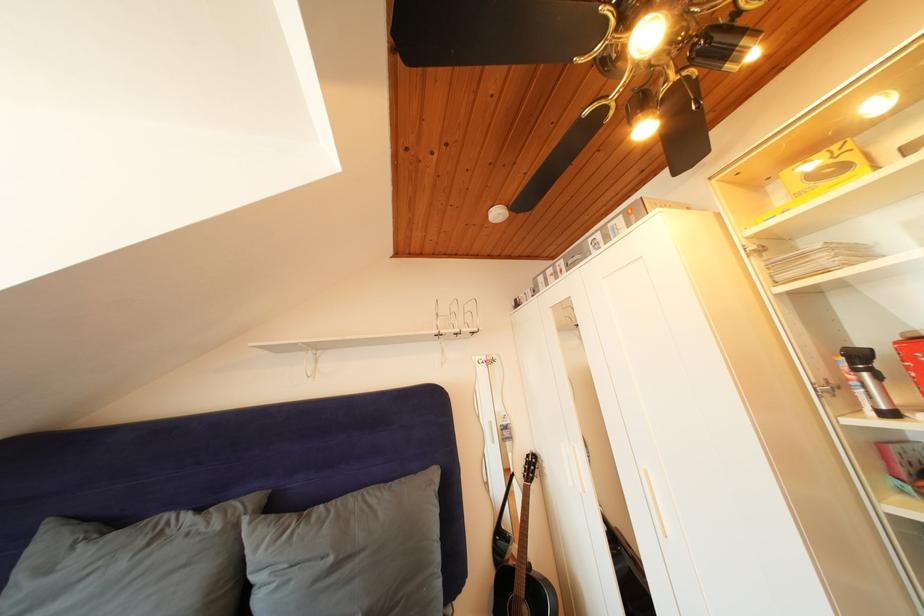
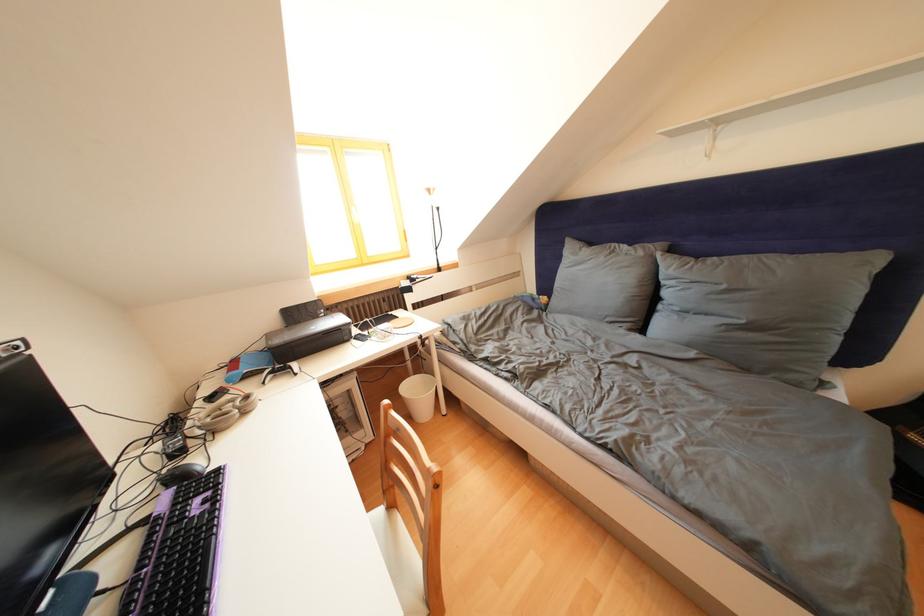
Where in the second image is the point corresponding to point (225, 531) from the first image?

(649, 259)